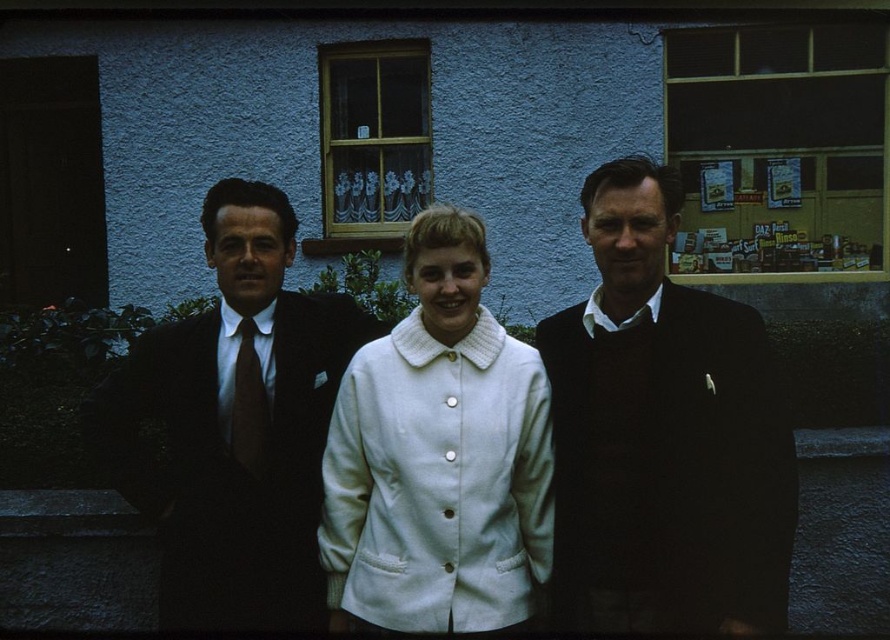
Question: Can you confirm if white woolen coat at center is wider than dark brown wool suit at center?

Choices:
 (A) no
 (B) yes

Answer: (A)

Question: Which point is closer to the camera taking this photo?

Choices:
 (A) (425, 620)
 (B) (247, 323)

Answer: (A)

Question: Among these points, which one is nearest to the camera?

Choices:
 (A) (166, 604)
 (B) (777, 440)
 (C) (249, 385)

Answer: (B)

Question: Is white woolen coat at center thinner than dark brown wool suit at center?

Choices:
 (A) no
 (B) yes

Answer: (B)

Question: Which object appears farthest from the camera in this image?

Choices:
 (A) satin brown tie at center
 (B) dark brown sweater at center

Answer: (A)

Question: From the image, what is the correct spatial relationship of dark brown wool suit at center in relation to satin brown tie at center?

Choices:
 (A) above
 (B) below

Answer: (B)